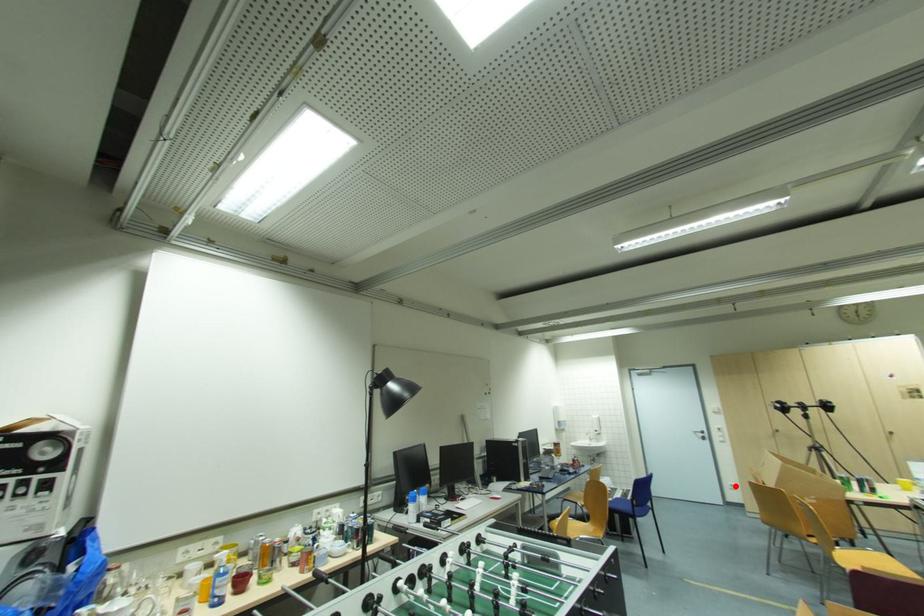
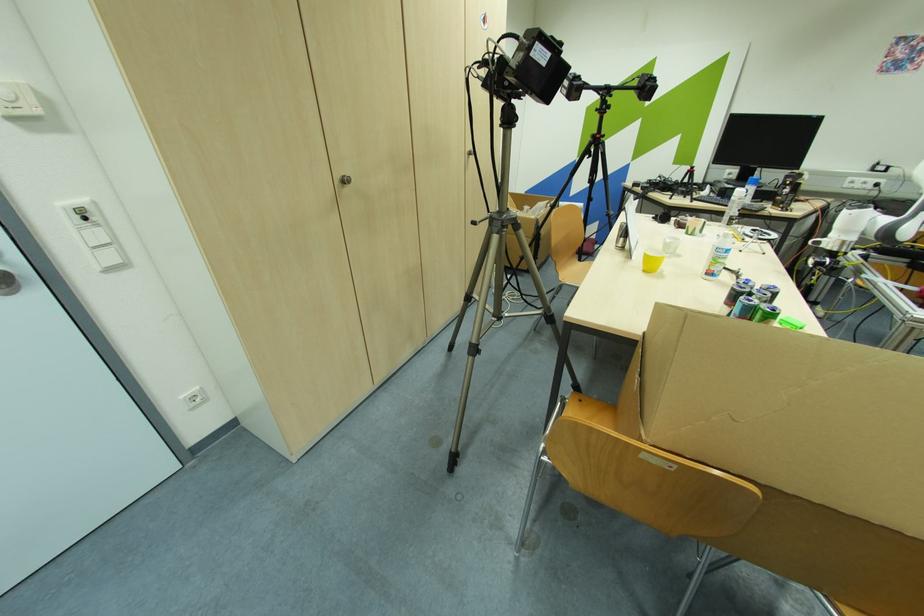
Question: A red point is marked in image1. In image2, is the corresponding 3D point closer to the camera or farther? Reply with the corresponding letter.

Choices:
 (A) The corresponding 3D point is closer.
 (B) The corresponding 3D point is farther.

Answer: (A)